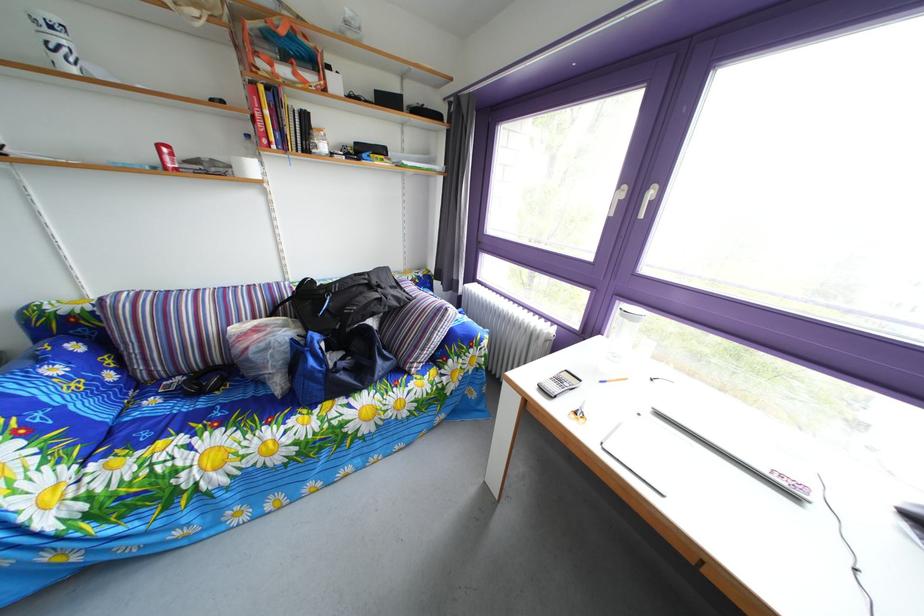
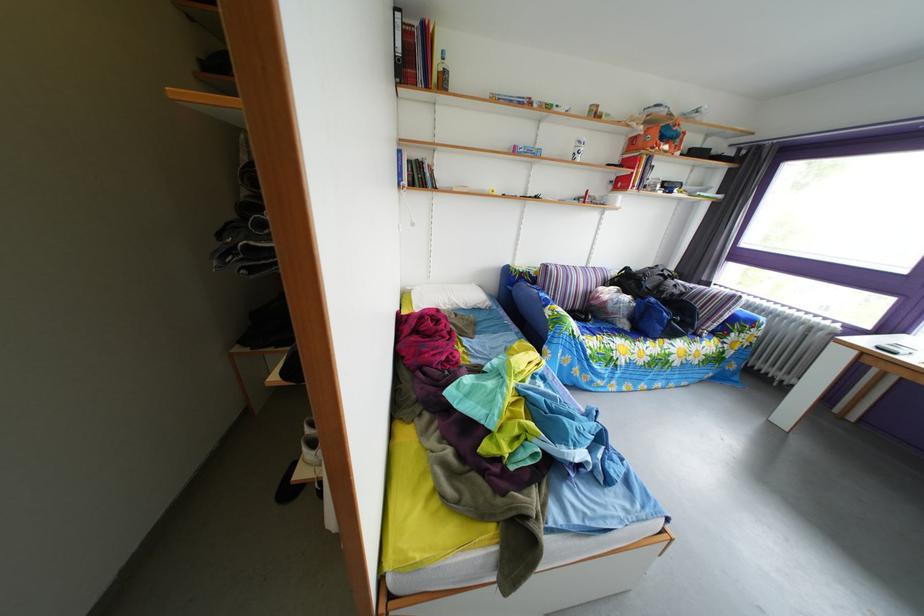
In the second image, find the point that corresponds to point 295,282 in the first image.

(599, 270)